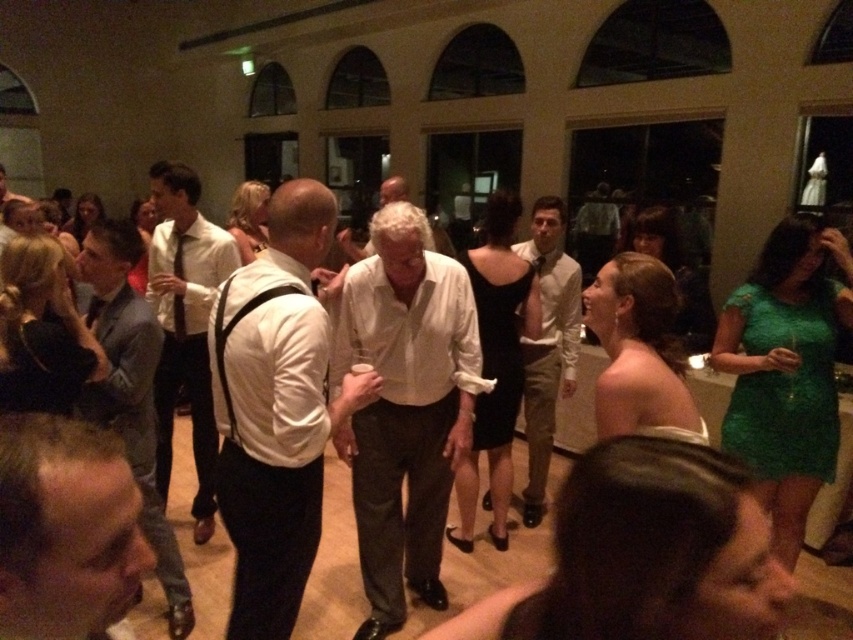
Question: Is the position of white cotton shirt at center more distant than that of light beige cotton shirt at center?

Choices:
 (A) no
 (B) yes

Answer: (A)

Question: Which point appears closest to the camera in this image?

Choices:
 (A) click(x=78, y=433)
 (B) click(x=125, y=340)
 (C) click(x=532, y=252)

Answer: (A)

Question: Considering the relative positions of white cotton shirt at center and light beige cotton shirt at center in the image provided, where is white cotton shirt at center located with respect to light beige cotton shirt at center?

Choices:
 (A) above
 (B) below

Answer: (B)

Question: Which object is closer to the camera taking this photo?

Choices:
 (A) white matte shirt at center
 (B) white shirt at center
 (C) light beige cotton shirt at center

Answer: (A)

Question: Which of the following is the farthest from the observer?

Choices:
 (A) light brown hair at lower left
 (B) light gray suit at center

Answer: (B)

Question: Does light brown hair at lower left have a lesser width compared to light gray suit at center?

Choices:
 (A) yes
 (B) no

Answer: (A)